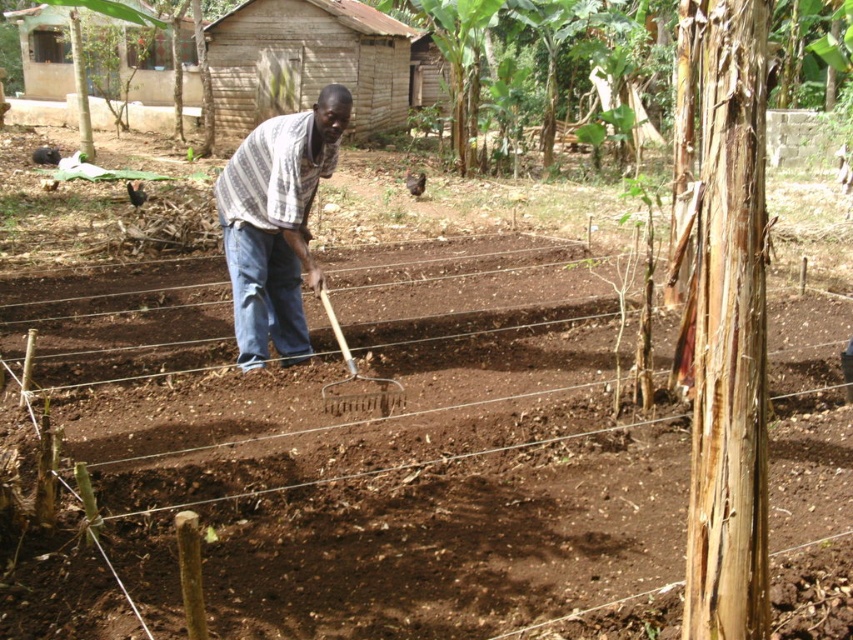
You are standing in the field and see two points marked in the image. Which point is closer to you, point (292, 118) or point (364, 392)?

Point (292, 118) is closer to you because it is further to the viewer than point (364, 392).